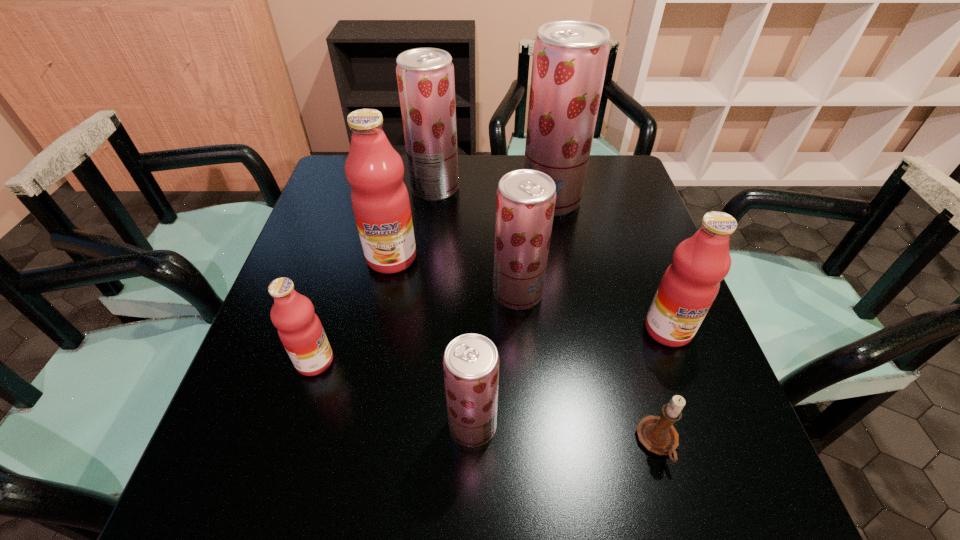
You are a GUI agent. You are given a task and a screenshot of the screen. Output one action in this format:
    pyautogui.click(x=<x>, y=<y>)
    Task: Click on the tallest fruit juice
    
    Given the screenshot: What is the action you would take?
    pyautogui.click(x=570, y=57)

The width and height of the screenshot is (960, 540). What are the coordinates of `the tallest object` in the screenshot? It's located at (570, 57).

The width and height of the screenshot is (960, 540). What are the coordinates of `the third smallest strawberry fruit juice` in the screenshot? It's located at (425, 76).

Image resolution: width=960 pixels, height=540 pixels. Find the location of `the farthest pink fruit juice`. the farthest pink fruit juice is located at coordinates (374, 169).

The height and width of the screenshot is (540, 960). What are the coordinates of `the biggest pink fruit juice` in the screenshot? It's located at (374, 169).

Where is `the third farthest strawberry fruit juice`? the third farthest strawberry fruit juice is located at coordinates (525, 200).

I want to click on the rightmost fruit juice, so click(689, 286).

Find the location of a particular element. the rightmost pink fruit juice is located at coordinates (689, 286).

Locate an element on the screen. The width and height of the screenshot is (960, 540). the smallest pink fruit juice is located at coordinates (300, 330).

Find the location of a particular element. the leftmost fruit juice is located at coordinates (300, 330).